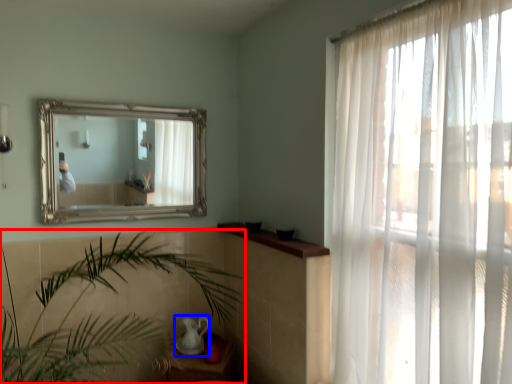
Question: Among these objects, which one is nearest to the camera, houseplant (highlighted by a red box) or tea pot (highlighted by a blue box)?

Choices:
 (A) houseplant
 (B) tea pot

Answer: (A)